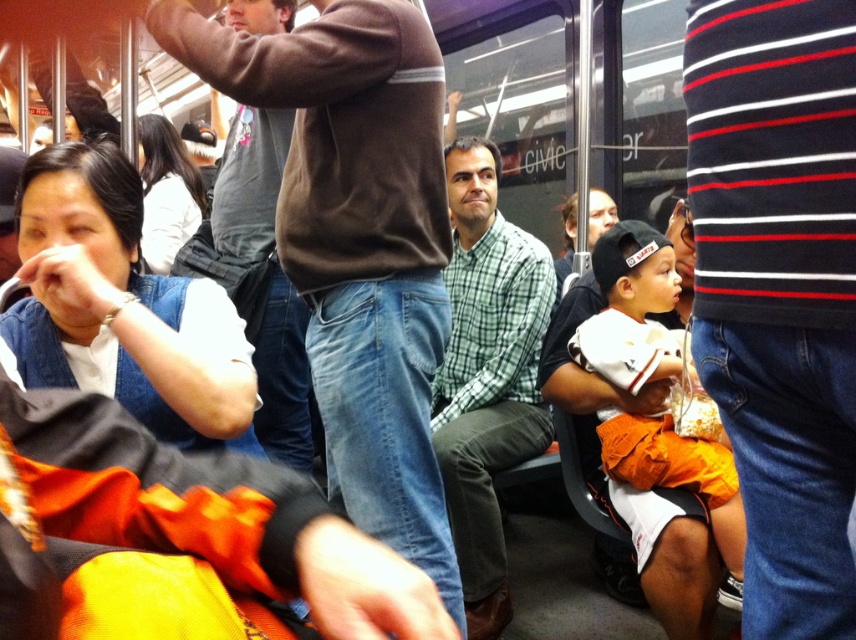
Question: Does black striped sweater at upper right appear on the right side of brown sweater at center?

Choices:
 (A) no
 (B) yes

Answer: (B)

Question: Among these points, which one is nearest to the camera?

Choices:
 (A) (455, 486)
 (B) (203, 356)

Answer: (B)

Question: Does black striped sweater at upper right appear on the right side of denim vest at left?

Choices:
 (A) no
 (B) yes

Answer: (B)

Question: Which is farther from the brown sweater at center?

Choices:
 (A) green checkered shirt at center
 (B) denim vest at left
 (C) black striped sweater at upper right

Answer: (A)

Question: Among these points, which one is farthest from the camera?

Choices:
 (A) (735, 36)
 (B) (88, 148)
 (C) (403, 134)

Answer: (C)

Question: Is black striped sweater at upper right wider than green checkered shirt at center?

Choices:
 (A) no
 (B) yes

Answer: (A)